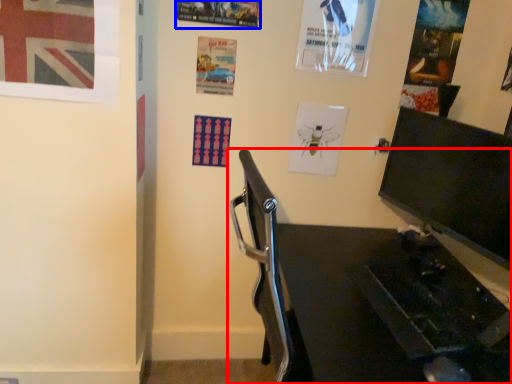
Question: Which object appears closest to the camera in this image, furniture (highlighted by a red box) or poster page (highlighted by a blue box)?

Choices:
 (A) furniture
 (B) poster page

Answer: (A)